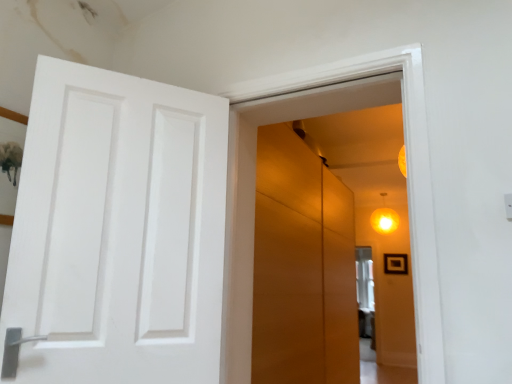
Question: Is matte yellow globe light at upper right a part of matte orange cabinet at center?

Choices:
 (A) no
 (B) yes

Answer: (A)

Question: From the image's perspective, is matte orange cabinet at center located beneath matte yellow globe light at upper right?

Choices:
 (A) no
 (B) yes

Answer: (B)

Question: Can you confirm if matte orange cabinet at center is smaller than matte yellow globe light at upper right?

Choices:
 (A) yes
 (B) no

Answer: (B)

Question: Can you confirm if matte orange cabinet at center is positioned to the right of matte yellow globe light at upper right?

Choices:
 (A) yes
 (B) no

Answer: (B)

Question: From a real-world perspective, is matte orange cabinet at center located higher than matte yellow globe light at upper right?

Choices:
 (A) yes
 (B) no

Answer: (B)

Question: Does matte orange cabinet at center turn towards matte yellow globe light at upper right?

Choices:
 (A) no
 (B) yes

Answer: (A)

Question: Does matte yellow globe light at upper right lie in front of matte orange cabinet at center?

Choices:
 (A) yes
 (B) no

Answer: (B)

Question: From the image's perspective, is matte yellow globe light at upper right above matte orange cabinet at center?

Choices:
 (A) no
 (B) yes

Answer: (B)

Question: Is there a large distance between matte yellow globe light at upper right and matte orange cabinet at center?

Choices:
 (A) no
 (B) yes

Answer: (B)

Question: Can you confirm if matte yellow globe light at upper right is smaller than matte orange cabinet at center?

Choices:
 (A) no
 (B) yes

Answer: (B)

Question: Does matte yellow globe light at upper right appear on the left side of matte orange cabinet at center?

Choices:
 (A) no
 (B) yes

Answer: (A)

Question: Is the depth of matte yellow globe light at upper right greater than that of matte orange cabinet at center?

Choices:
 (A) yes
 (B) no

Answer: (A)

Question: Does black matte picture frame at upper right have a smaller size compared to matte yellow globe light at upper right?

Choices:
 (A) no
 (B) yes

Answer: (B)